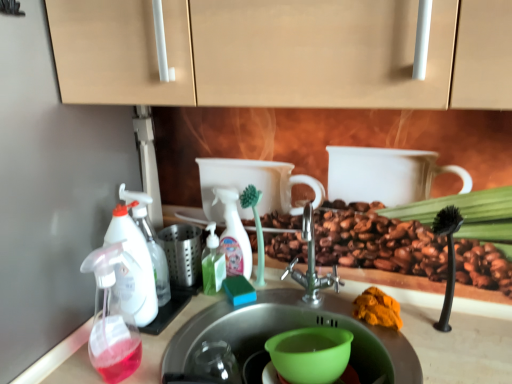
I want to click on vacant space behind translucent plastic spray bottle at left, the 3th soap dispenser viewed from the back, so click(178, 323).